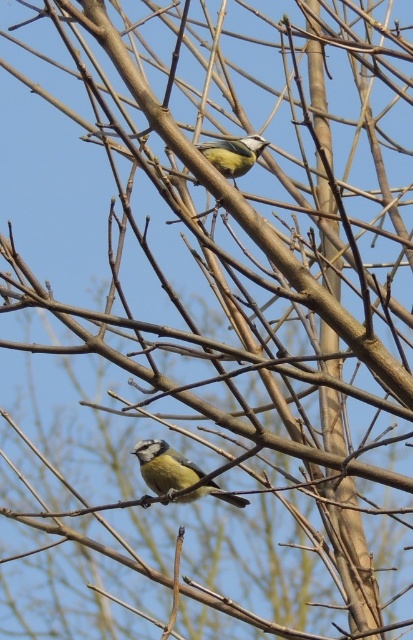
You are observing two birds on a tree branch. You notice a point marked at coordinates (165, 467). Based on the scene description, what is located at this point?

The point at coordinates (165, 467) corresponds to blue green feathers at lower center.